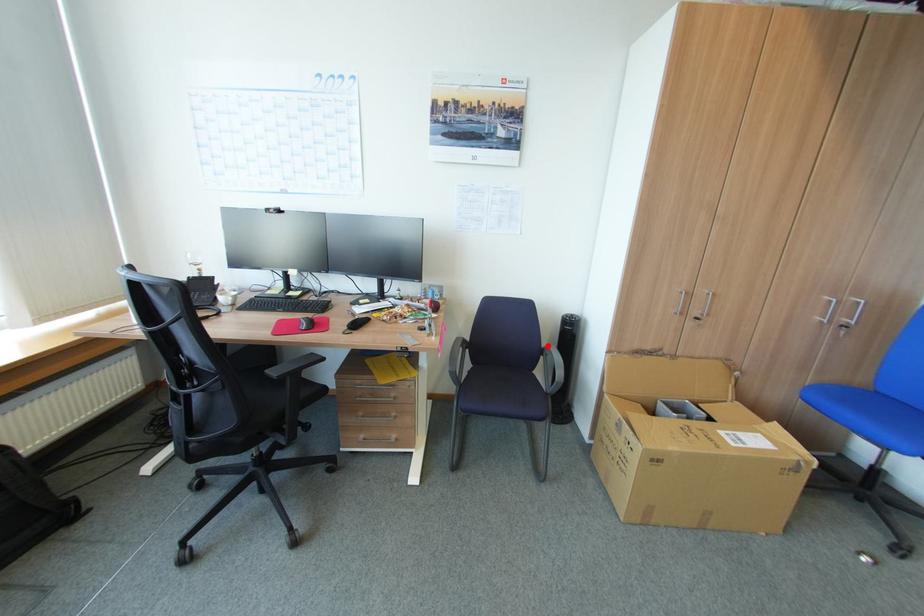
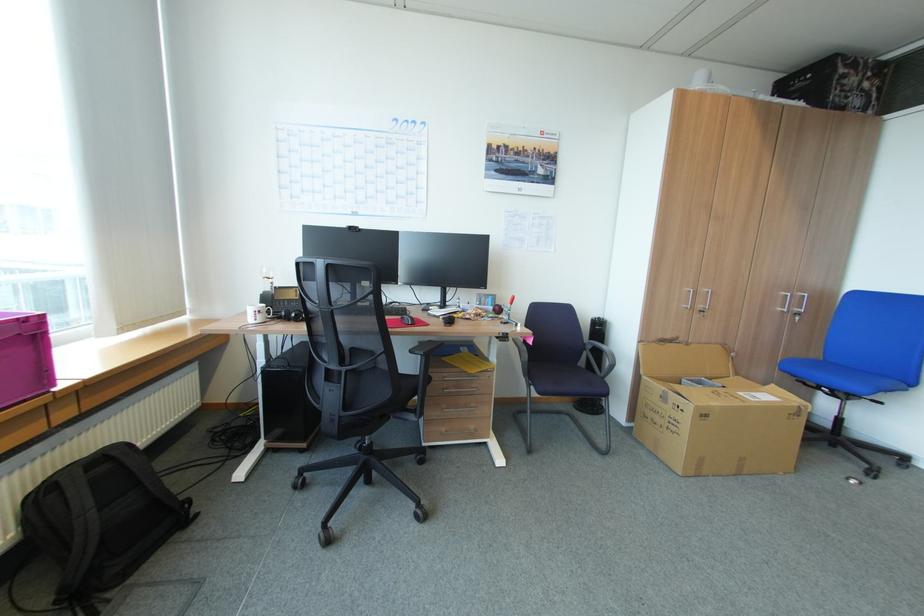
Locate, in the second image, the point that corresponds to the highlighted location in the first image.

(590, 342)